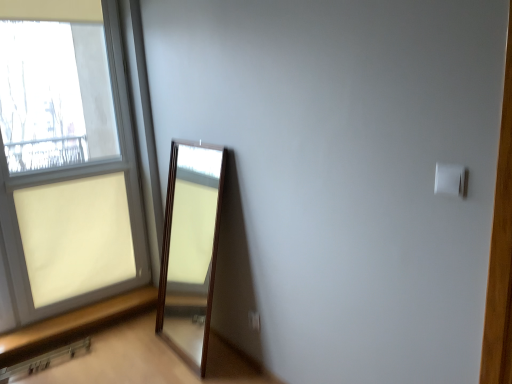
The width and height of the screenshot is (512, 384). I want to click on matte glass window at left, so click(67, 169).

Find the location of a particular element. brown wooden window sill at lower left is located at coordinates (73, 325).

This screenshot has height=384, width=512. Identify the location of white plastic light switch at upper right. (450, 179).

Is white plastic light switch at upper right facing away from white plastic electric outlet at lower center?

No, white plastic light switch at upper right is not facing away from white plastic electric outlet at lower center.

Does white plastic light switch at upper right have a lesser height compared to white plastic electric outlet at lower center?

No, white plastic light switch at upper right is not shorter than white plastic electric outlet at lower center.

From a real-world perspective, which object rests below the other?

white plastic electric outlet at lower center, from a real-world perspective.

Considering the positions of objects white plastic electric outlet at lower center and matte glass window at left in the image provided, who is more to the right, white plastic electric outlet at lower center or matte glass window at left?

white plastic electric outlet at lower center is more to the right.

Who is bigger, white plastic electric outlet at lower center or matte glass window at left?

Bigger between the two is matte glass window at left.

Which of these two, white plastic electric outlet at lower center or matte glass window at left, is wider?

matte glass window at left is wider.

Is white plastic electric outlet at lower center aimed at matte glass window at left?

No, white plastic electric outlet at lower center is not turned towards matte glass window at left.

Locate an element on the screen. The height and width of the screenshot is (384, 512). electric outlet on the right of brown wooden window sill at lower left is located at coordinates (254, 320).

Are brown wooden window sill at lower left and white plastic electric outlet at lower center making contact?

No, brown wooden window sill at lower left is not next to white plastic electric outlet at lower center.

Based on the photo, can you confirm if brown wooden window sill at lower left is taller than white plastic electric outlet at lower center?

In fact, brown wooden window sill at lower left may be shorter than white plastic electric outlet at lower center.

Is point (136, 311) positioned before point (256, 328)?

No, (136, 311) is further to viewer.

Considering the points (250, 325) and (451, 173), which point is in front, point (250, 325) or point (451, 173)?

The point (451, 173) is closer to the camera.

Who is bigger, white plastic electric outlet at lower center or white plastic light switch at upper right?

Bigger between the two is white plastic electric outlet at lower center.

Would you consider white plastic electric outlet at lower center to be distant from white plastic light switch at upper right?

Yes, white plastic electric outlet at lower center and white plastic light switch at upper right are located far from each other.

Measure the distance from white plastic light switch at upper right to brown wooden window sill at lower left.

white plastic light switch at upper right is 7.68 feet from brown wooden window sill at lower left.

Who is bigger, white plastic light switch at upper right or brown wooden window sill at lower left?

brown wooden window sill at lower left is bigger.

Is point (461, 188) positioned behind point (98, 324)?

No, it is not.

Based on the photo, looking at their sizes, would you say white plastic light switch at upper right is wider or thinner than brown wooden window sill at lower left?

white plastic light switch at upper right is thinner than brown wooden window sill at lower left.

In the image, is matte glass window at left positioned in front of or behind brown wooden window sill at lower left?

Clearly, matte glass window at left is in front of brown wooden window sill at lower left.

Considering the positions of objects matte glass window at left and brown wooden window sill at lower left in the image provided, who is more to the right, matte glass window at left or brown wooden window sill at lower left?

From the viewer's perspective, brown wooden window sill at lower left appears more on the right side.

Considering the positions of point (129, 208) and point (23, 327), is point (129, 208) closer or farther from the camera than point (23, 327)?

Point (129, 208) is farther from the camera than point (23, 327).

Which of these two, matte glass window at left or brown wooden window sill at lower left, is smaller?

brown wooden window sill at lower left.

Considering the sizes of objects matte glass window at left and white plastic electric outlet at lower center in the image provided, who is bigger, matte glass window at left or white plastic electric outlet at lower center?

matte glass window at left is bigger.

Is matte glass window at left positioned with its back to white plastic electric outlet at lower center?

No, matte glass window at left is not facing the opposite direction of white plastic electric outlet at lower center.

Is the depth of matte glass window at left greater than that of white plastic electric outlet at lower center?

That is False.

Considering the relative sizes of matte glass window at left and white plastic electric outlet at lower center in the image provided, is matte glass window at left thinner than white plastic electric outlet at lower center?

In fact, matte glass window at left might be wider than white plastic electric outlet at lower center.

In order to click on light switch on the right of white plastic electric outlet at lower center in this screenshot , I will do `click(450, 179)`.

What are the coordinates of `window above the white plastic electric outlet at lower center (from a real-world perspective)` in the screenshot? It's located at (67, 169).

Which object lies nearer to the anchor point white plastic light switch at upper right, brown wooden window sill at lower left or white plastic electric outlet at lower center?

white plastic electric outlet at lower center lies closer to white plastic light switch at upper right than the other object.

Considering their positions, is matte glass window at left positioned closer to white plastic light switch at upper right than white plastic electric outlet at lower center?

white plastic electric outlet at lower center is closer to white plastic light switch at upper right.

Estimate the real-world distances between objects in this image. Which object is closer to matte glass window at left, brown wooden window sill at lower left or white plastic light switch at upper right?

brown wooden window sill at lower left.

Based on their spatial positions, is white plastic light switch at upper right or brown wooden window sill at lower left closer to matte glass window at left?

brown wooden window sill at lower left lies closer to matte glass window at left than the other object.

In the scene shown: Considering their positions, is matte glass window at left positioned closer to white plastic electric outlet at lower center than brown wooden window sill at lower left?

Among the two, brown wooden window sill at lower left is located nearer to white plastic electric outlet at lower center.

Which object lies further to the anchor point white plastic electric outlet at lower center, brown wooden window sill at lower left or white plastic light switch at upper right?

Among the two, white plastic light switch at upper right is located further to white plastic electric outlet at lower center.

Which object lies further to the anchor point white plastic light switch at upper right, brown wooden window sill at lower left or matte glass window at left?

matte glass window at left lies further to white plastic light switch at upper right than the other object.

Consider the image. Considering their positions, is matte glass window at left positioned further to white plastic light switch at upper right than brown wooden window sill at lower left?

matte glass window at left is positioned further to the anchor white plastic light switch at upper right.

In order to click on window sill situated between matte glass window at left and white plastic electric outlet at lower center from left to right in this screenshot , I will do (73, 325).

The image size is (512, 384). Identify the location of electric outlet between brown wooden window sill at lower left and white plastic light switch at upper right from left to right. (254, 320).

The width and height of the screenshot is (512, 384). I want to click on electric outlet located between matte glass window at left and white plastic light switch at upper right in the left-right direction, so click(x=254, y=320).

Image resolution: width=512 pixels, height=384 pixels. Identify the location of window sill between matte glass window at left and white plastic light switch at upper right from left to right. (73, 325).